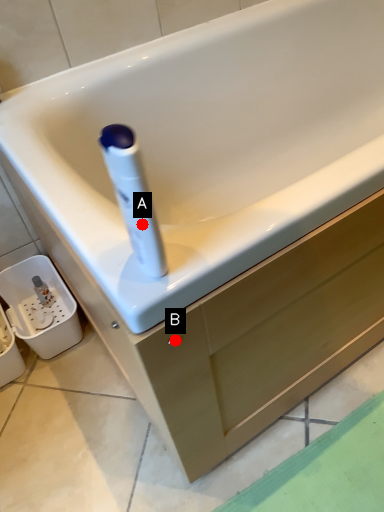
Question: Two points are circled on the image, labeled by A and B beside each circle. Which of the following is the closest to the observer?

Choices:
 (A) A is closer
 (B) B is closer

Answer: (A)